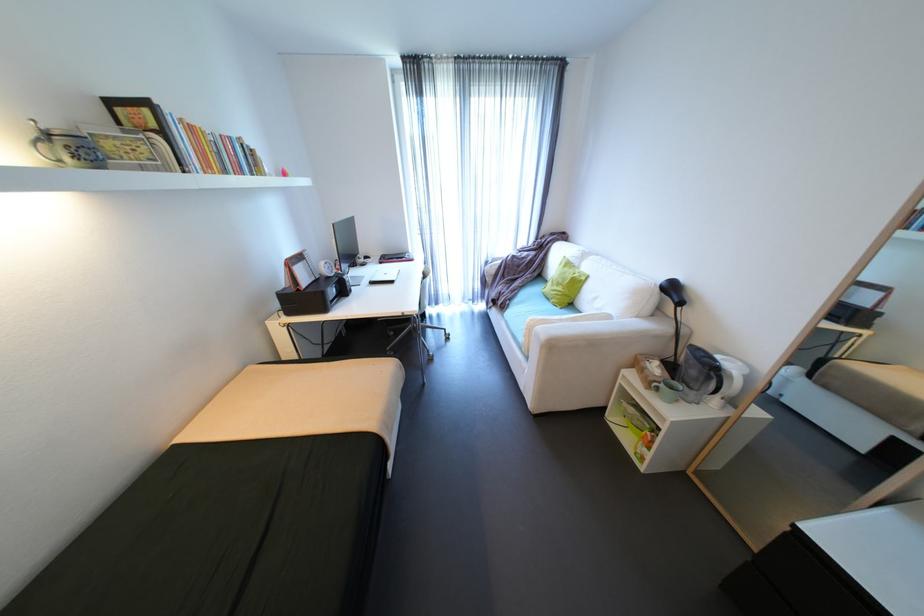
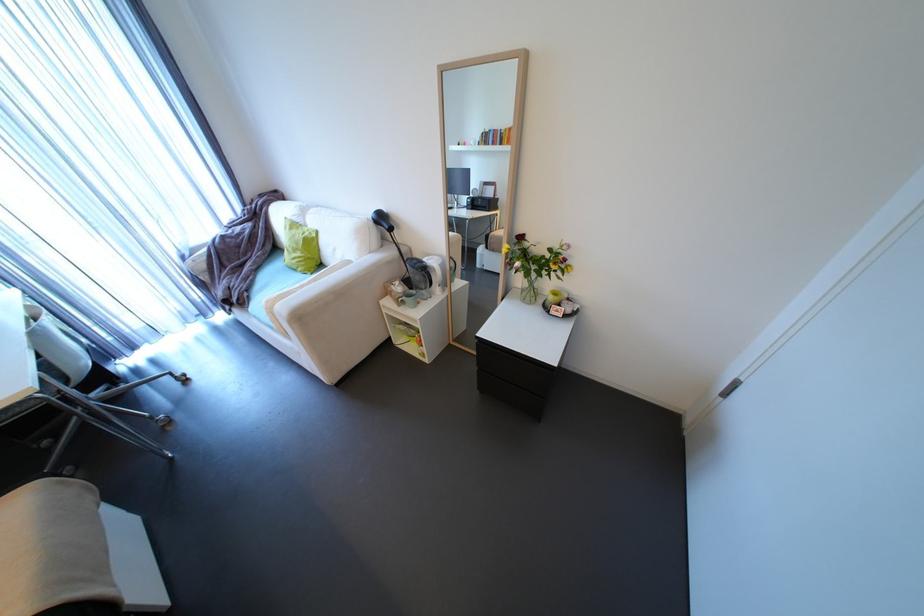
Find the pixel in the second image that matches pixel 412 315 in the first image.

(7, 408)